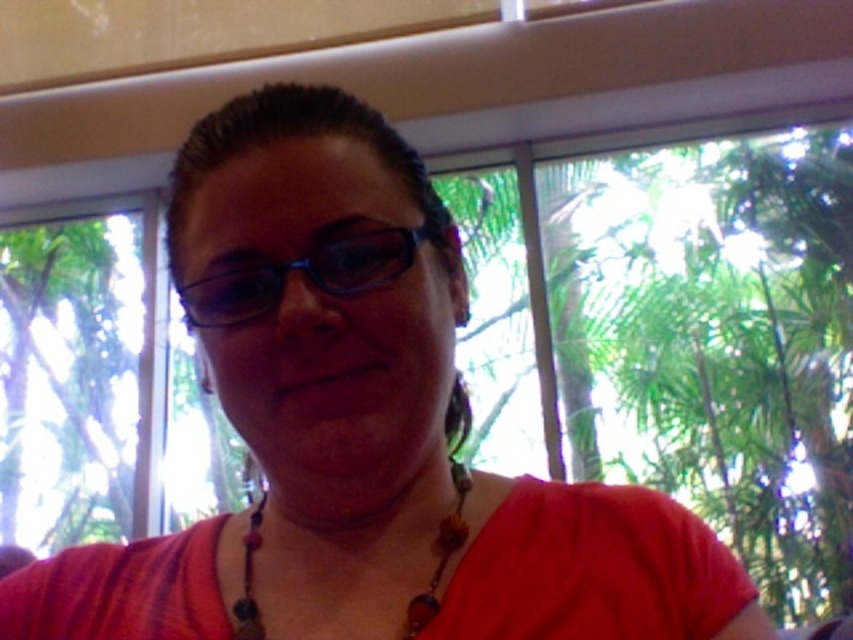
Question: Among these objects, which one is farthest from the camera?

Choices:
 (A) transparent plastic glasses at center
 (B) beaded necklace at center

Answer: (B)

Question: Observing the image, what is the correct spatial positioning of transparent plastic glasses at center in reference to beaded necklace at center?

Choices:
 (A) left
 (B) right

Answer: (A)

Question: Is transparent plastic glasses at center positioned before beaded necklace at center?

Choices:
 (A) no
 (B) yes

Answer: (B)

Question: Is transparent plastic glasses at center to the right of beaded necklace at center from the viewer's perspective?

Choices:
 (A) yes
 (B) no

Answer: (B)

Question: Which point is farther to the camera?

Choices:
 (A) (241, 307)
 (B) (234, 630)

Answer: (B)